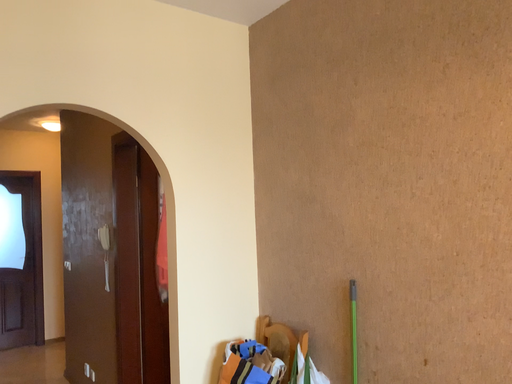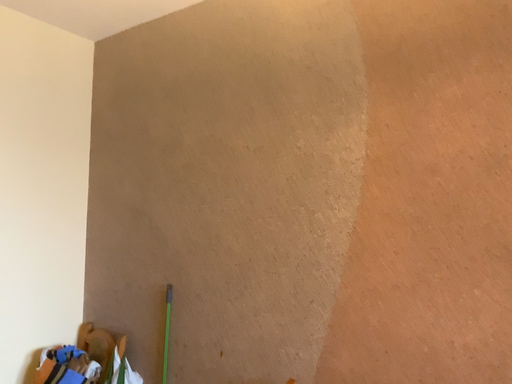
Question: How did the camera likely rotate when shooting the video?

Choices:
 (A) rotated right
 (B) rotated left

Answer: (A)